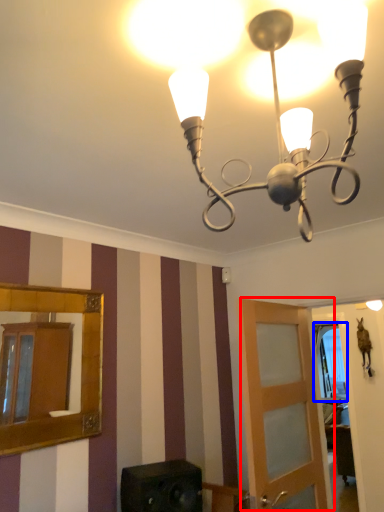
Question: Which of the following is the closest to the observer, door (highlighted by a red box) or window (highlighted by a blue box)?

Choices:
 (A) door
 (B) window

Answer: (A)